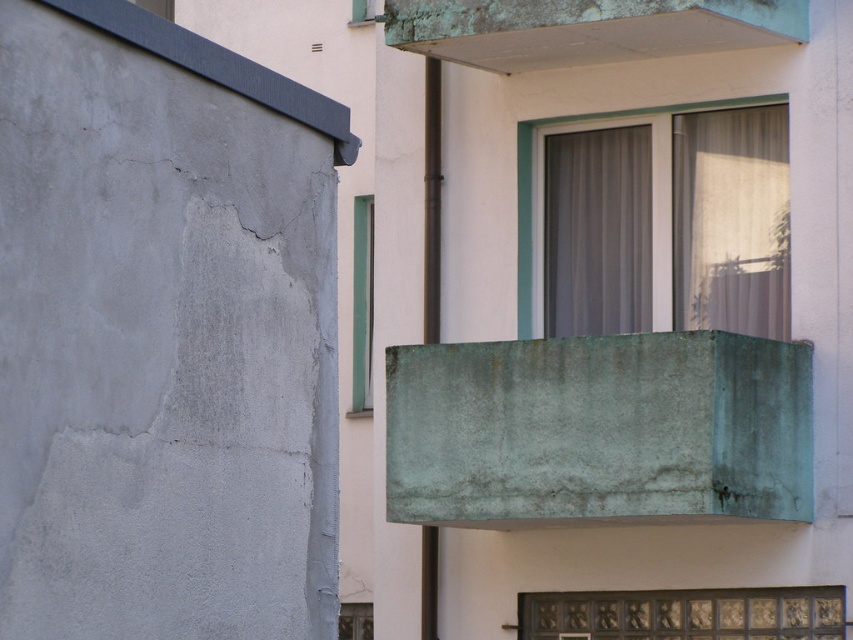
Question: Considering the relative positions of gray fabric curtain at center and smooth concrete ledge at upper left in the image provided, where is gray fabric curtain at center located with respect to smooth concrete ledge at upper left?

Choices:
 (A) below
 (B) above

Answer: (A)

Question: Can you confirm if green patina concrete balcony at upper center is smaller than translucent glass window at upper center?

Choices:
 (A) no
 (B) yes

Answer: (A)

Question: Which object is farther from the camera taking this photo?

Choices:
 (A) carved wood panel at lower center
 (B) sheer fabric curtain at upper center
 (C) smooth concrete ledge at upper left

Answer: (B)

Question: Is sheer fabric curtain at upper center thinner than green glass door at center?

Choices:
 (A) no
 (B) yes

Answer: (A)

Question: Which point is closer to the camera taking this photo?

Choices:
 (A) (799, 614)
 (B) (531, 125)
 (C) (352, 378)
 (D) (646, 404)

Answer: (D)

Question: Which point is closer to the camera?

Choices:
 (A) sheer fabric curtain at upper center
 (B) green glass door at center

Answer: (A)